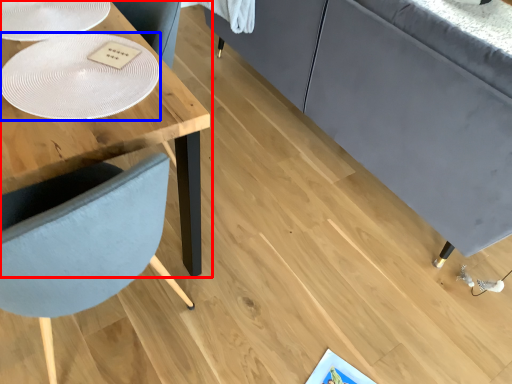
Question: Which object is further to the camera taking this photo, table (highlighted by a red box) or glass plate (highlighted by a blue box)?

Choices:
 (A) table
 (B) glass plate

Answer: (A)